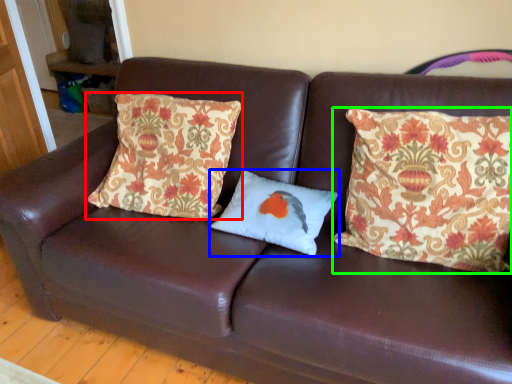
Question: Considering the real-world distances, which object is farthest from pillow (highlighted by a red box)? pillow (highlighted by a blue box) or pillow (highlighted by a green box)?

Choices:
 (A) pillow
 (B) pillow

Answer: (B)